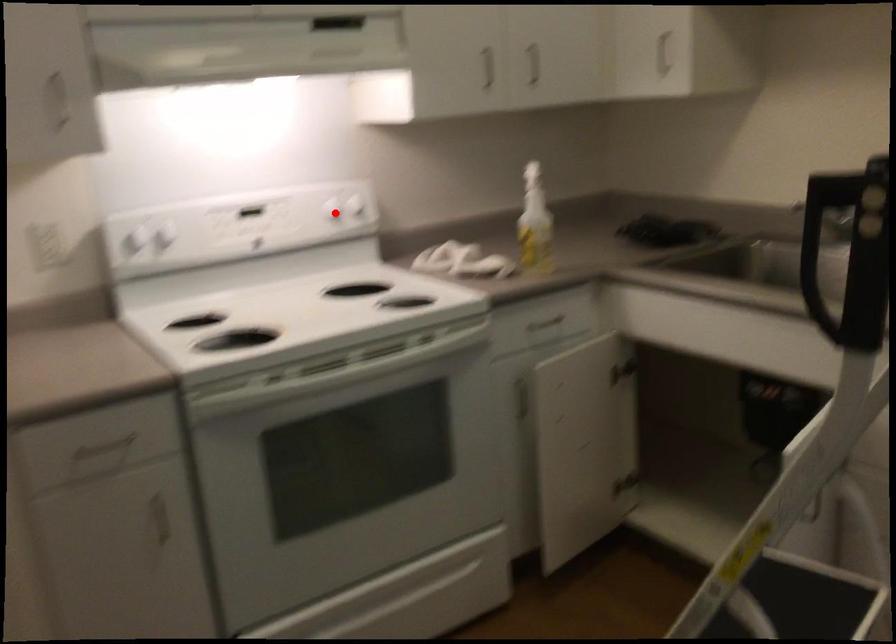
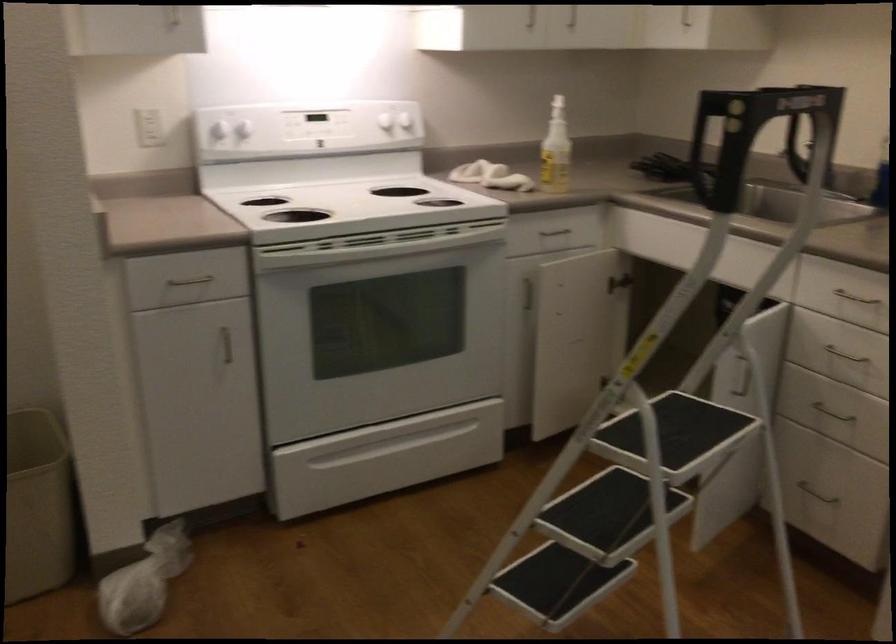
Question: I am providing you with two images of the same scene from different viewpoints. In image1, a red point is highlighted. Considering the same 3D point in image2, which of the following is correct?

Choices:
 (A) It is closer
 (B) It is farther

Answer: (B)